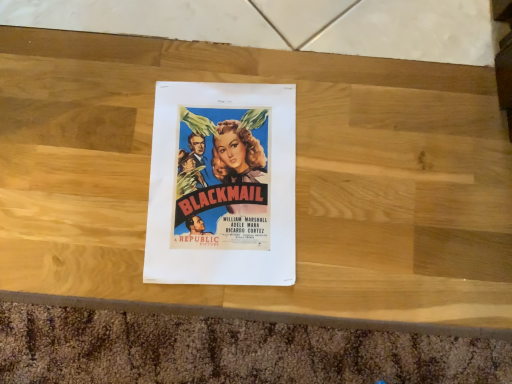
Where is `free space above matte paper poster at center (from a real-world perspective)`? free space above matte paper poster at center (from a real-world perspective) is located at coordinates (220, 176).